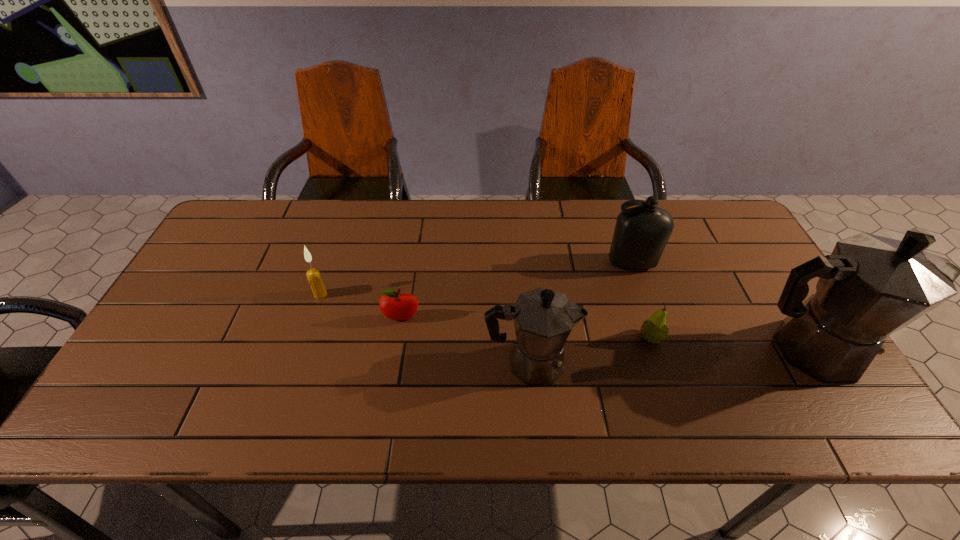
Considering the uniform spacing of coffeepots, where should an additional coffeepot be positioned on the left? Please locate a free spot. Please provide its 2D coordinates. Your answer should be formatted as a tuple, i.e. [(x, y)], where the tuple contains the x and y coordinates of a point satisfying the conditions above.

[(238, 376)]